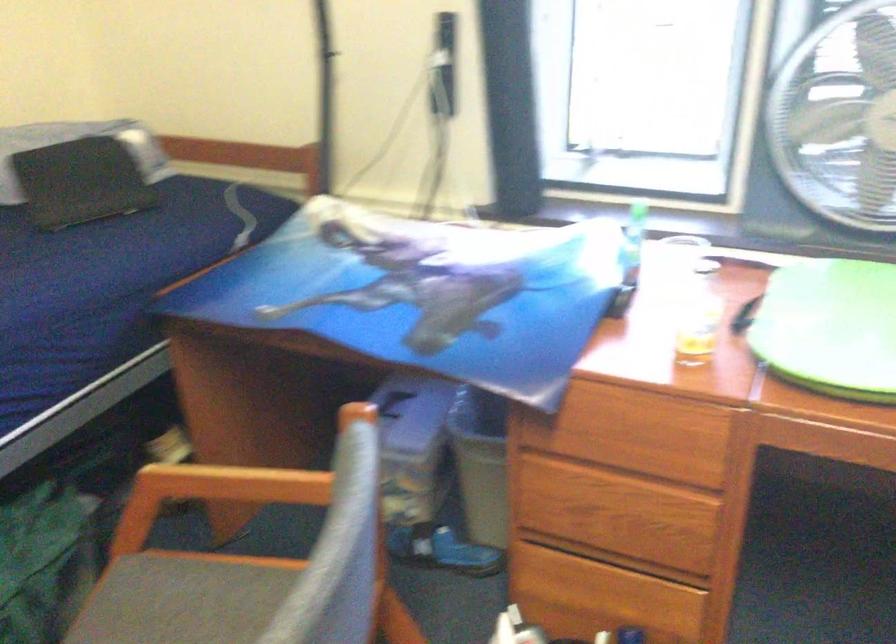
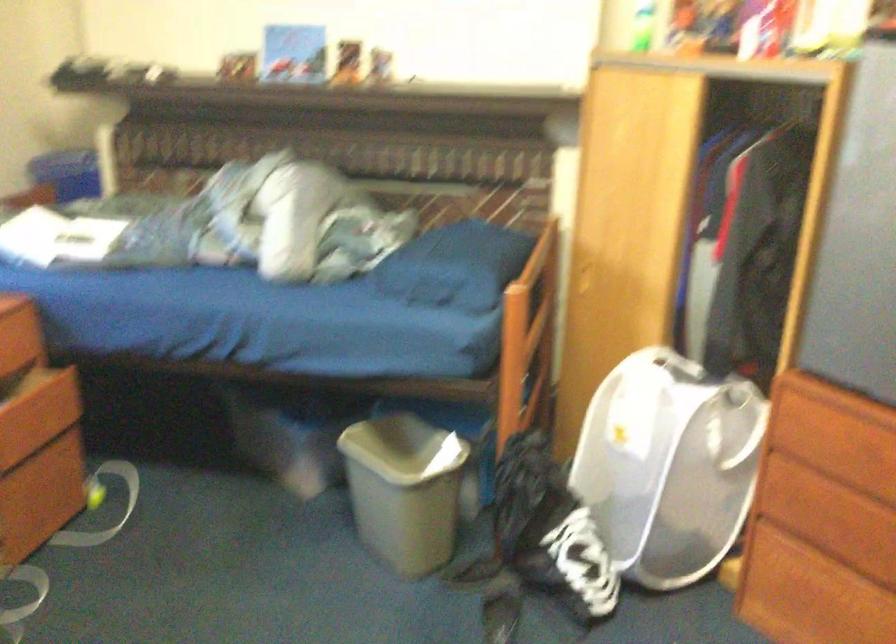
How did the camera likely rotate?

The rotation direction of the camera is right-down.